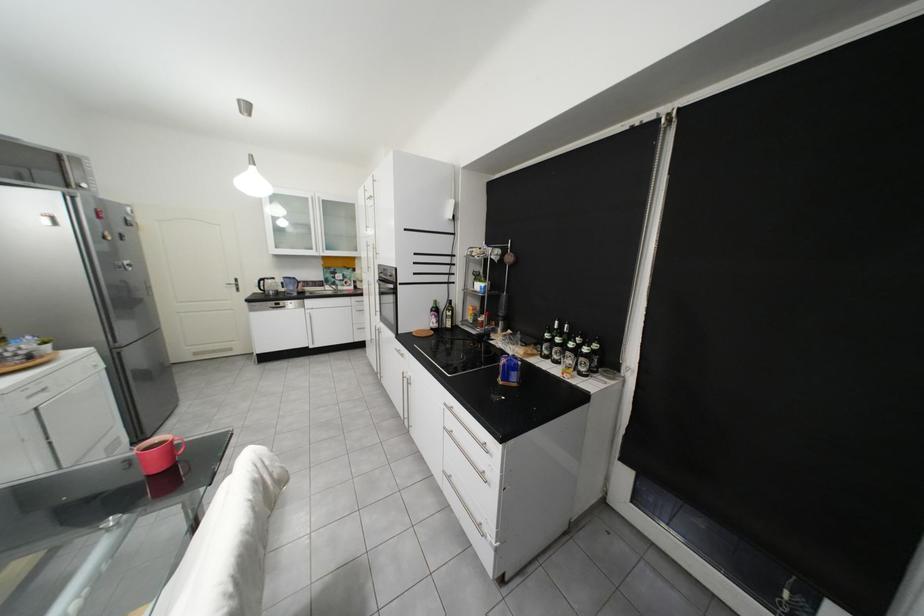
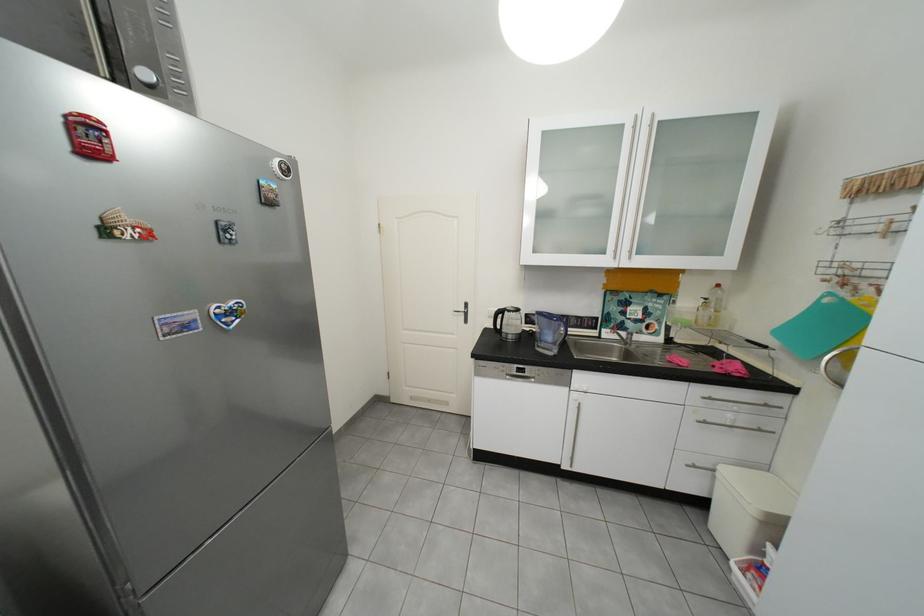
Locate, in the second image, the point that corresponds to pixel 274 281 in the first image.

(513, 313)